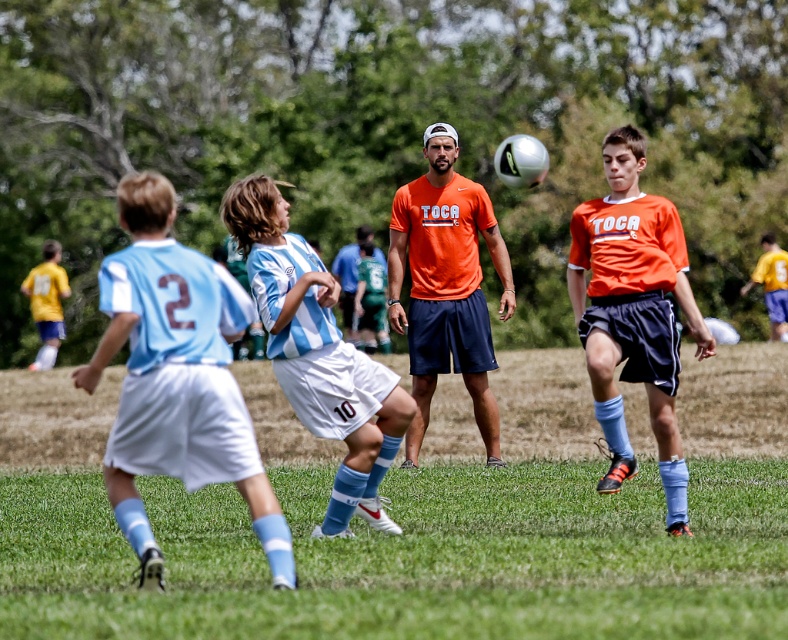
Does blue/white striped jersey at center have a greater width compared to orange matte shirt at center?

Yes, blue/white striped jersey at center is wider than orange matte shirt at center.

Which of these two, blue/white striped jersey at center or orange matte shirt at center, stands shorter?

blue/white striped jersey at center

At what (x,y) coordinates should I click in order to perform the action: click on blue/white striped jersey at center. Please return your answer as a coordinate pair (x, y). This screenshot has width=788, height=640. Looking at the image, I should click on (318, 353).

Does light blue jersey at center have a lesser height compared to matte green jersey at center?

Yes.

Which is more to the left, light blue jersey at center or matte green jersey at center?

Positioned to the left is matte green jersey at center.

This screenshot has width=788, height=640. I want to click on light blue jersey at center, so click(x=177, y=378).

Based on the photo, can you confirm if orange matte jersey at center is taller than matte green jersey at center?

Yes.

The width and height of the screenshot is (788, 640). Describe the element at coordinates (634, 312) in the screenshot. I see `orange matte jersey at center` at that location.

Measure the distance between orange matte jersey at center and camera.

orange matte jersey at center is 29.96 feet from camera.

This screenshot has height=640, width=788. In order to click on orange matte jersey at center in this screenshot , I will do `click(634, 312)`.